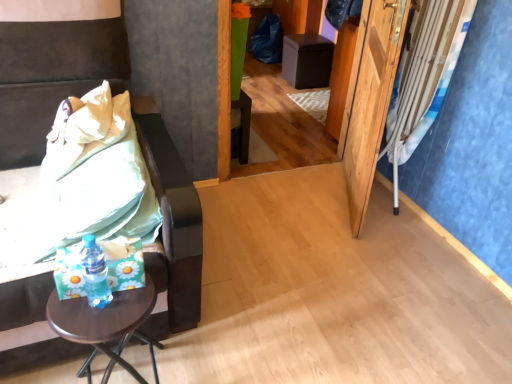
This screenshot has width=512, height=384. Find the location of `free space in front of wooden screen door at right`. free space in front of wooden screen door at right is located at coordinates (368, 255).